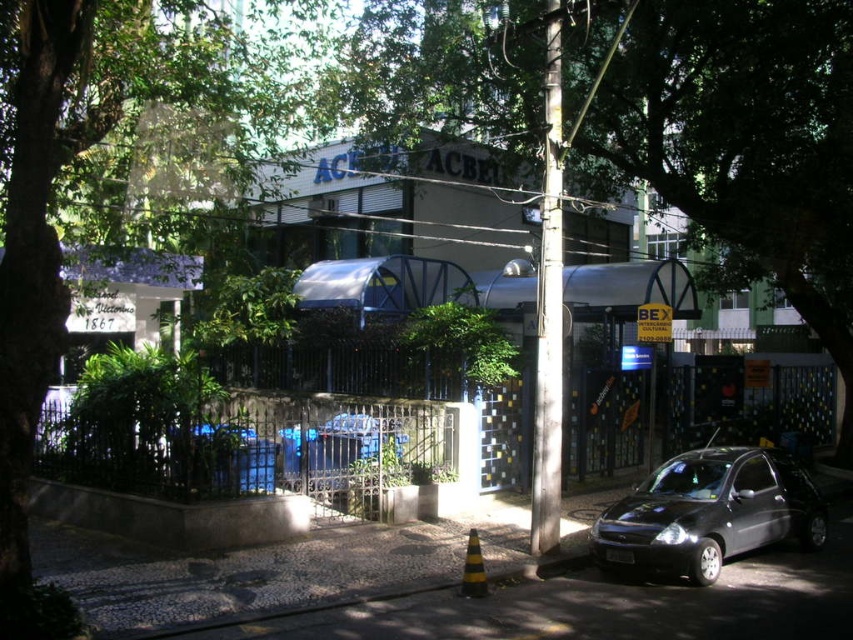
Can you confirm if green leafy tree at center is thinner than matte black car at lower right?

Incorrect, green leafy tree at center's width is not less than matte black car at lower right's.

Looking at this image, is green leafy tree at center below matte black car at lower right?

No, green leafy tree at center is not below matte black car at lower right.

The image size is (853, 640). What do you see at coordinates (653, 120) in the screenshot?
I see `green leafy tree at center` at bounding box center [653, 120].

Find the location of a particular element. The width and height of the screenshot is (853, 640). green leafy tree at center is located at coordinates (653, 120).

Which of these two, green leafy tree at left or matte black car at lower right, stands shorter?

Standing shorter between the two is matte black car at lower right.

Between point (86, 113) and point (723, 538), which one is positioned behind?

The point (86, 113) is more distant.

Between point (282, 88) and point (659, 564), which one is positioned behind?

The point (282, 88) is more distant.

You are a GUI agent. You are given a task and a screenshot of the screen. Output one action in this format:
    pyautogui.click(x=<x>, y=<y>)
    Task: Click on the green leafy tree at left
    Image resolution: width=853 pixels, height=640 pixels.
    Given the screenshot: What is the action you would take?
    pos(54,202)

Can you confirm if green leafy tree at center is positioned below green leafy tree at left?

Yes, green leafy tree at center is below green leafy tree at left.

Is point (708, 236) positioned behind point (90, 67)?

Yes, point (708, 236) is farther from viewer.

Where is `green leafy tree at center`? This screenshot has width=853, height=640. green leafy tree at center is located at coordinates (653, 120).